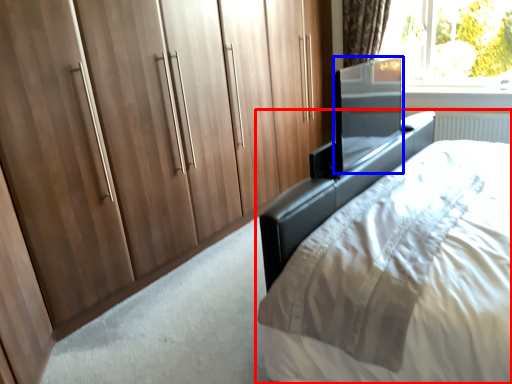
Question: Among these objects, which one is nearest to the camera, bed (highlighted by a red box) or screen door (highlighted by a blue box)?

Choices:
 (A) bed
 (B) screen door

Answer: (A)